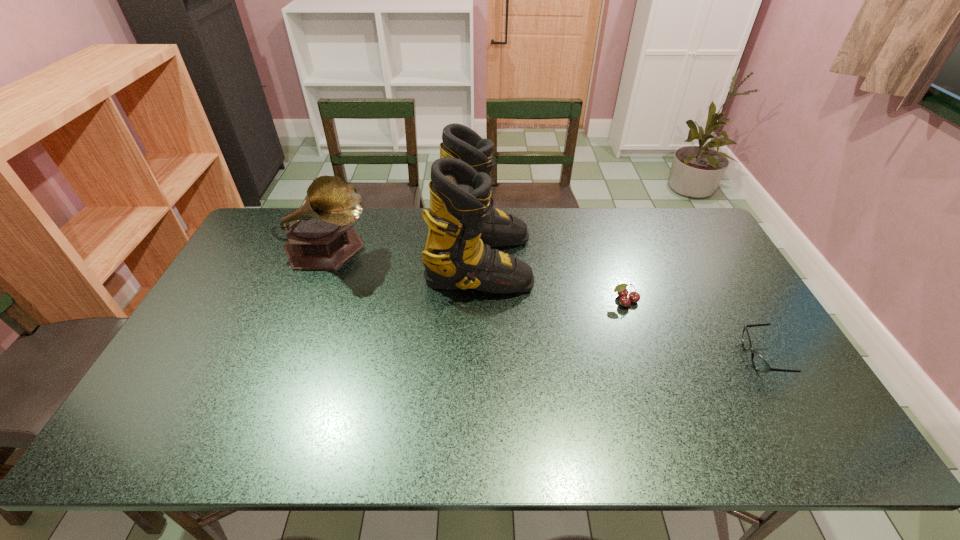
Identify the location of ski boots. (462, 224).

Image resolution: width=960 pixels, height=540 pixels. I want to click on the third object from right to left, so click(462, 224).

Locate an element on the screen. The width and height of the screenshot is (960, 540). the third shortest object is located at coordinates (320, 234).

Find the location of a particular element. phonograph record is located at coordinates point(320,234).

What are the coordinates of `the second object from right to left` in the screenshot? It's located at (621, 290).

Locate an element on the screen. The width and height of the screenshot is (960, 540). the third tallest object is located at coordinates coord(621,290).

Find the location of `the rightmost object`. the rightmost object is located at coordinates (759, 363).

In order to click on the nearest object in this screenshot , I will do `click(759, 363)`.

Identify the location of vacant area situated 0.330m on the left of the tallest object. The image size is (960, 540). (327, 261).

Locate an element on the screen. The height and width of the screenshot is (540, 960). free region located 0.180m on the horn direction of the phonograph record is located at coordinates (427, 251).